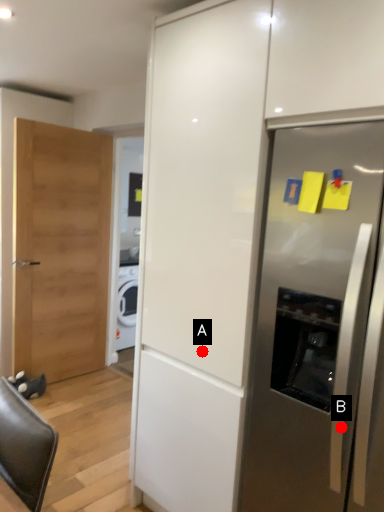
Question: Two points are circled on the image, labeled by A and B beside each circle. Which point is further to the camera?

Choices:
 (A) A is further
 (B) B is further

Answer: (A)